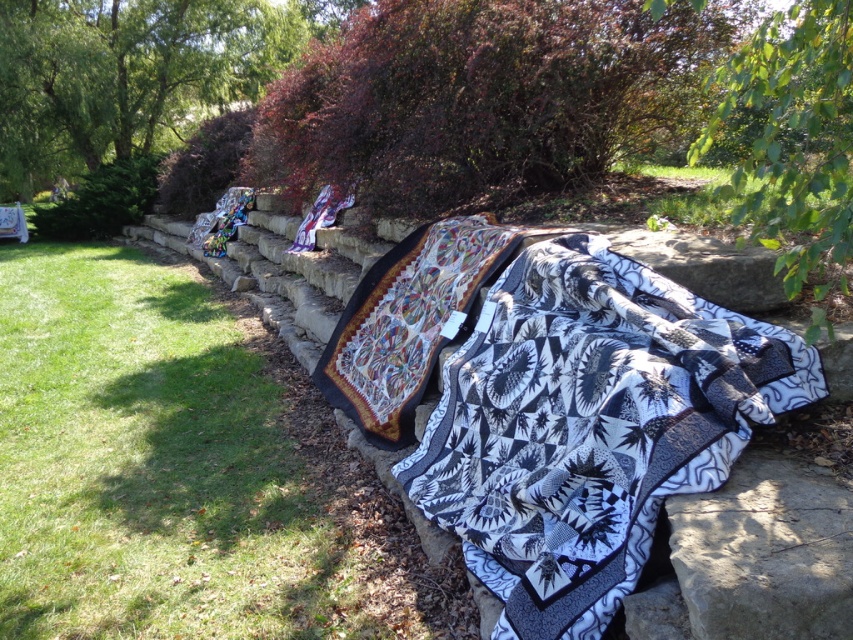
Question: Among these objects, which one is nearest to the camera?

Choices:
 (A) green leafy tree at upper right
 (B) purple leafy bush at upper center
 (C) green leafy tree at upper center

Answer: (A)

Question: Is purple leafy bush at upper center bigger than green leafy tree at upper right?

Choices:
 (A) no
 (B) yes

Answer: (A)

Question: Which object is the closest to the green leafy tree at upper right?

Choices:
 (A) green grass at lower left
 (B) black quilt at center

Answer: (B)

Question: Does green leafy tree at upper center have a larger size compared to green leafy tree at upper right?

Choices:
 (A) yes
 (B) no

Answer: (B)

Question: Which point is farther to the camera?

Choices:
 (A) (757, 179)
 (B) (595, 440)
 (C) (515, 52)
 (D) (3, 45)

Answer: (D)

Question: Can you confirm if black quilt at center is thinner than green leafy tree at upper right?

Choices:
 (A) no
 (B) yes

Answer: (A)